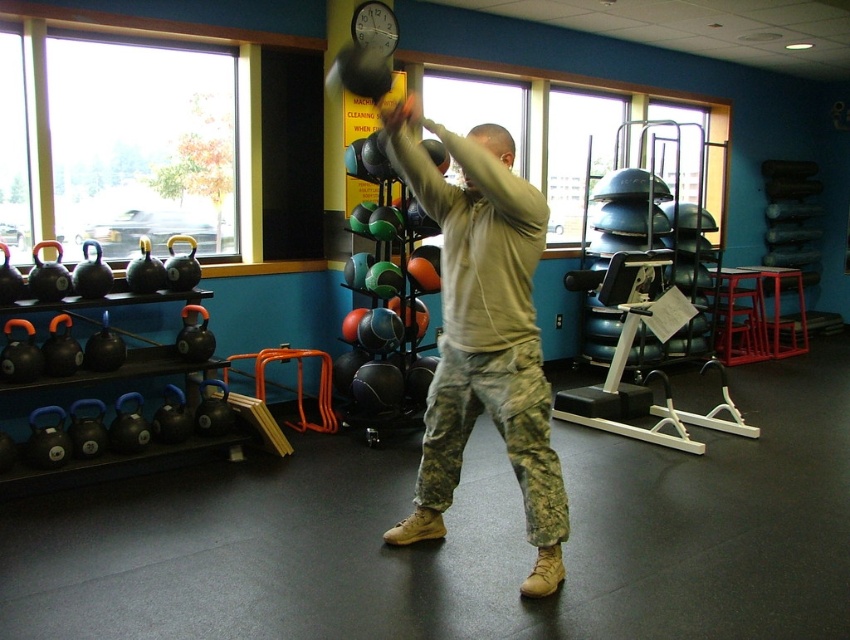
You are a fitness trainer observing a client in the gym. The client is wearing camouflage pants at center and has light brown hair at center. Based on their positions, which object is higher up on the client?

The camouflage pants at center is much taller than the light brown hair at center, so the camouflage pants at center is higher up on the client.

You are standing at the point labeled as point (547, 472) in the gym. You want to move to the location where the person is currently exercising. Can you walk directly to them without moving around any obstacles?

The point labeled point (547, 472) is 9.45 feet away from the viewer, so yes, you can walk directly to the person without needing to move around obstacles since there is enough space between them.

You are a gym trainer observing a client in the gym. You see the camouflage pants at center and the light brown hair at center. Which object is located to the right of the other?

The camouflage pants at center is positioned on the left side of light brown hair at center, so the light brown hair at center is to the right of the camouflage pants at center.